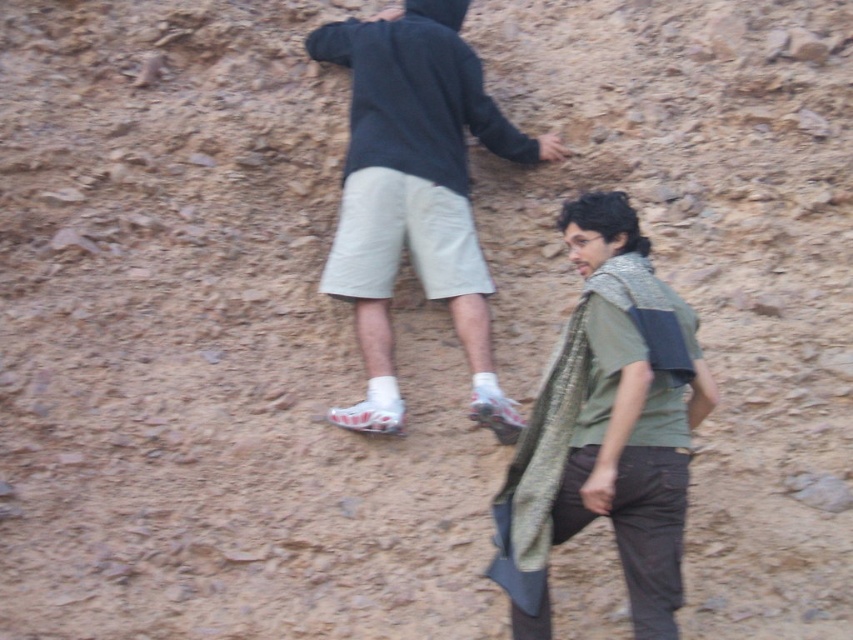
Measure the distance from green textured shirt at center to dark gray hoodie at upper center.

A distance of 1.20 meters exists between green textured shirt at center and dark gray hoodie at upper center.

Is point (683, 429) more distant than point (370, 236)?

No, (683, 429) is closer to viewer.

At what (x,y) coordinates should I click in order to perform the action: click on green textured shirt at center. Please return your answer as a coordinate pair (x, y). The image size is (853, 640). Looking at the image, I should click on (607, 428).